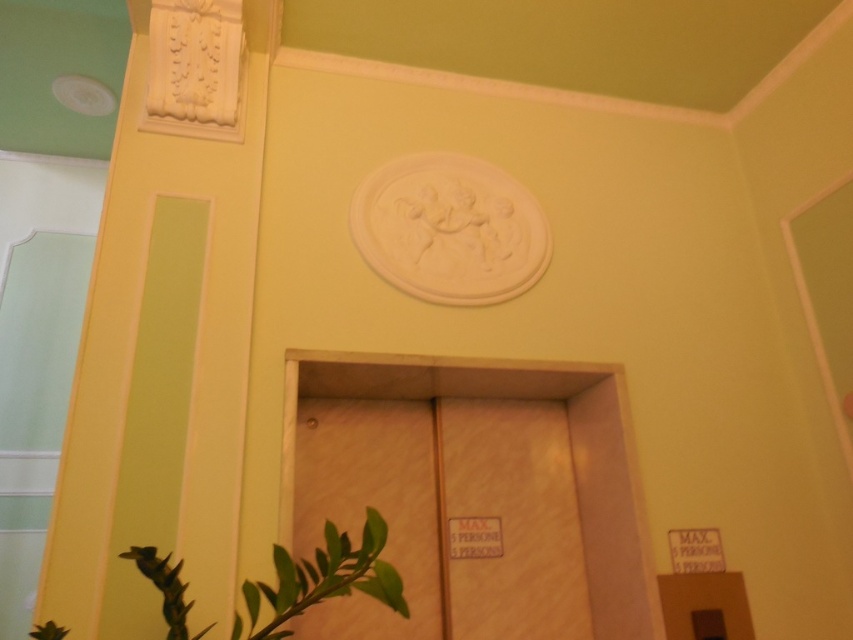
You are designing a layout for a new office space and need to place a desk between the wooden elevator at center and the green matte plant at lower left. Considering their widths, which object should you position closer to the desk to ensure it fits comfortably?

The wooden elevator at center is wider than the green matte plant at lower left. To ensure the desk fits comfortably, position the desk closer to the green matte plant at lower left since it has a narrower width.

You are designing a layout for a new office space and need to place a small table between the wooden elevator at center and the green matte plant at lower left. Considering their sizes, which object should the table be closer to?

The wooden elevator at center is larger in size than the green matte plant at lower left, so the table should be placed closer to the green matte plant at lower left to maintain balance in the layout.

You are standing in the lobby and see the wooden elevator at center and the green matte plant at lower left. Which object is positioned to the right of the other?

The wooden elevator at center is to the right of the green matte plant at lower left.